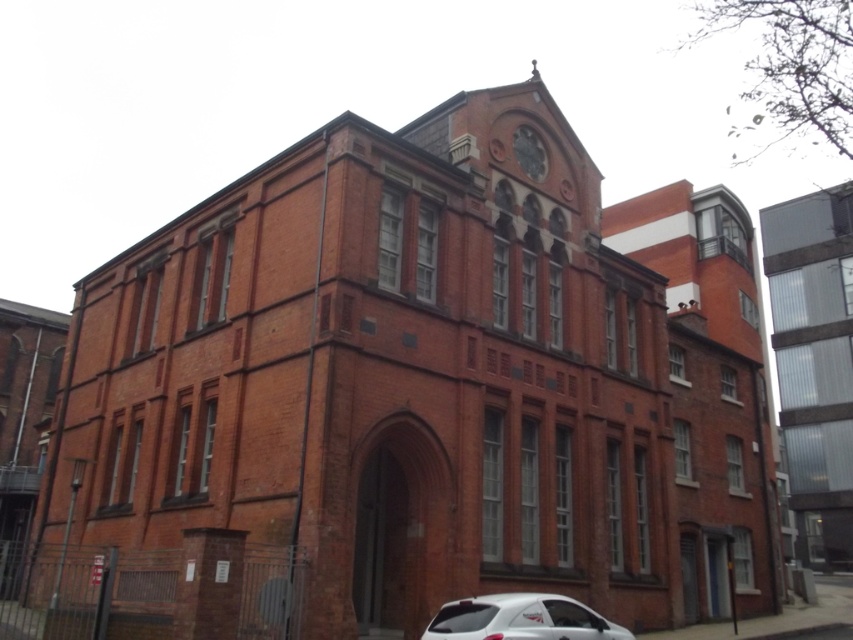
Question: Which point appears closest to the camera in this image?

Choices:
 (A) (579, 612)
 (B) (788, 344)

Answer: (A)

Question: Which point is closer to the camera?

Choices:
 (A) white glossy car at lower center
 (B) clear glass building at right

Answer: (A)

Question: In this image, where is clear glass building at right located relative to white glossy car at lower center?

Choices:
 (A) right
 (B) left

Answer: (A)

Question: Is clear glass building at right bigger than white glossy car at lower center?

Choices:
 (A) no
 (B) yes

Answer: (B)

Question: Is clear glass building at right wider than white glossy car at lower center?

Choices:
 (A) yes
 (B) no

Answer: (A)

Question: Which point appears closest to the camera in this image?

Choices:
 (A) (434, 637)
 (B) (846, 336)

Answer: (A)